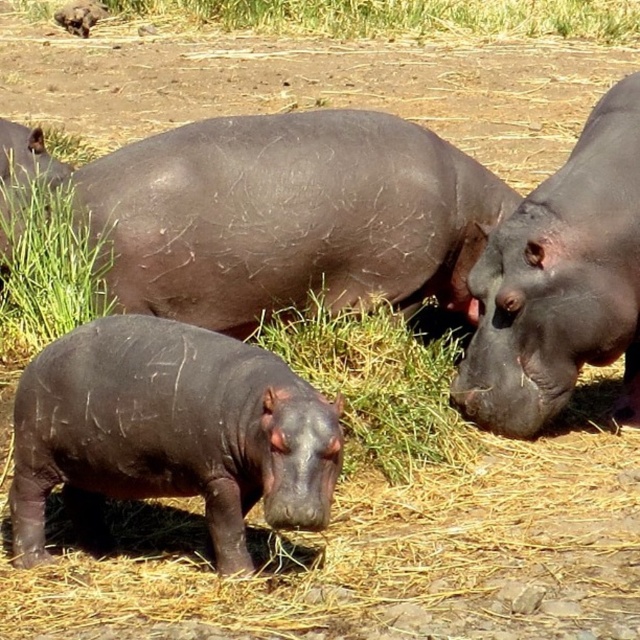
Question: Is shiny dark brown hippo at center smaller than dark brown skin at upper left?

Choices:
 (A) no
 (B) yes

Answer: (A)

Question: Is green grass at lower left positioned at the back of dark brown skin at upper left?

Choices:
 (A) yes
 (B) no

Answer: (B)

Question: Which of the following is the closest to the observer?

Choices:
 (A) (588, 188)
 (B) (148, 449)
 (C) (22, 173)

Answer: (B)

Question: Among these objects, which one is nearest to the camera?

Choices:
 (A) green grass at upper center
 (B) shiny dark brown hippo at lower left
 (C) shiny dark brown hippo at center
 (D) green grass at lower left

Answer: (B)

Question: Which of the following is the closest to the observer?

Choices:
 (A) (100, 272)
 (B) (22, 128)
 (C) (595, 196)

Answer: (C)

Question: Is matte dark brown hippo at center above shiny dark brown hippo at center?

Choices:
 (A) no
 (B) yes

Answer: (B)